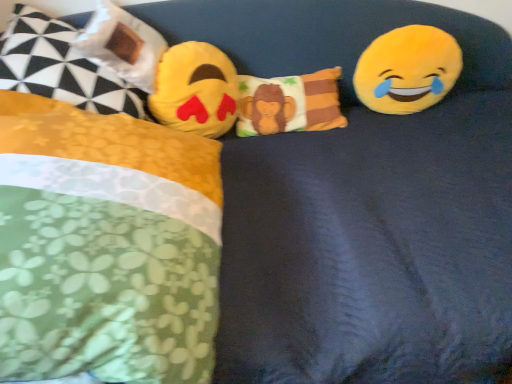
The height and width of the screenshot is (384, 512). I want to click on blank space situated above yellow plush emoji at center, the 2th toy in the right-to-left sequence (from a real-world perspective), so click(x=184, y=60).